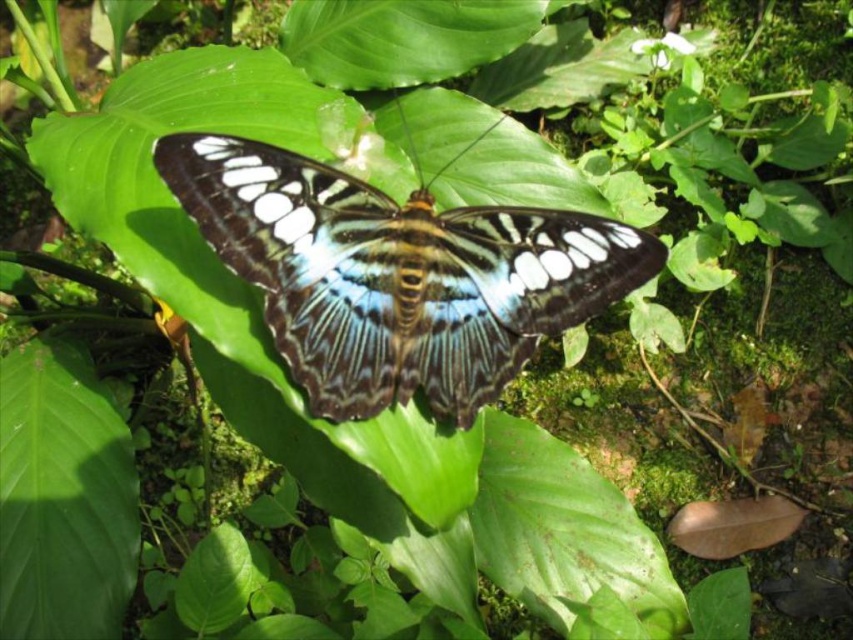
Question: Does translucent iridescent butterfly at center appear over green matte leaf at center?

Choices:
 (A) yes
 (B) no

Answer: (A)

Question: Which point is farther to the camera?

Choices:
 (A) green matte leaf at center
 (B) translucent iridescent butterfly at center

Answer: (A)

Question: Is translucent iridescent butterfly at center behind green matte leaf at center?

Choices:
 (A) yes
 (B) no

Answer: (B)

Question: Is translucent iridescent butterfly at center to the right of green matte leaf at center from the viewer's perspective?

Choices:
 (A) no
 (B) yes

Answer: (B)

Question: Which object appears closest to the camera in this image?

Choices:
 (A) green matte leaf at center
 (B) translucent iridescent butterfly at center

Answer: (B)